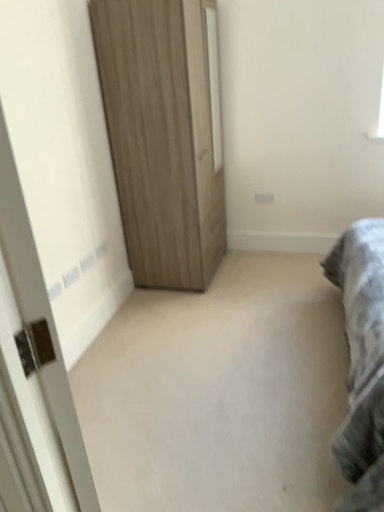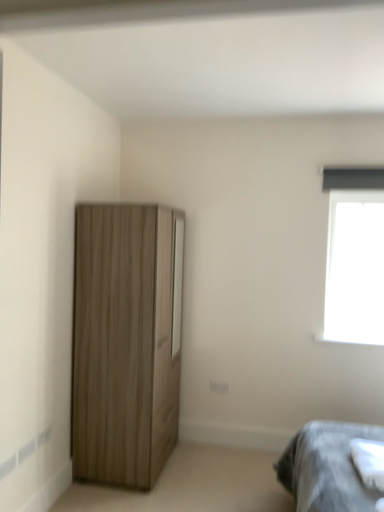
Question: Which way did the camera rotate in the video?

Choices:
 (A) rotated right
 (B) rotated left

Answer: (A)